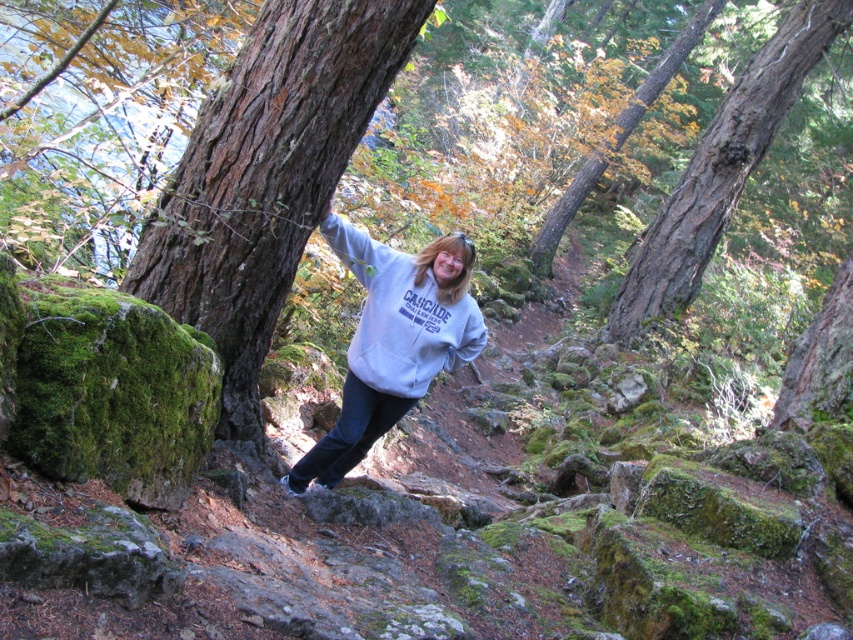
Measure the distance between point (608, 337) and camera.

A distance of 17.10 meters exists between point (608, 337) and camera.

Is brown rough bark at upper right thinner than smooth bark tree at upper center?

Correct, brown rough bark at upper right's width is less than smooth bark tree at upper center's.

Locate an element on the screen. The image size is (853, 640). brown rough bark at upper right is located at coordinates (720, 170).

Who is shorter, brown rough tree trunk at center or smooth bark tree at upper center?

With less height is brown rough tree trunk at center.

Is brown rough tree trunk at center to the left of smooth bark tree at upper center from the viewer's perspective?

Yes, brown rough tree trunk at center is to the left of smooth bark tree at upper center.

Who is more forward, (254, 419) or (631, 106)?

Positioned in front is point (254, 419).

Find the location of a particular element. brown rough tree trunk at center is located at coordinates (265, 177).

Does light gray sweatshirt at center have a lesser height compared to smooth bark tree at upper center?

Yes.

From the picture: Who is taller, light gray sweatshirt at center or smooth bark tree at upper center?

With more height is smooth bark tree at upper center.

This screenshot has height=640, width=853. Describe the element at coordinates (393, 340) in the screenshot. I see `light gray sweatshirt at center` at that location.

Locate an element on the screen. Image resolution: width=853 pixels, height=640 pixels. light gray sweatshirt at center is located at coordinates (393, 340).